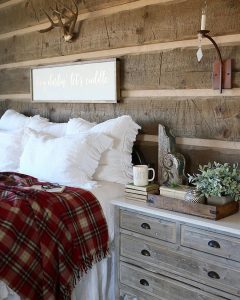
I want to click on figurine wooden, so click(171, 168).